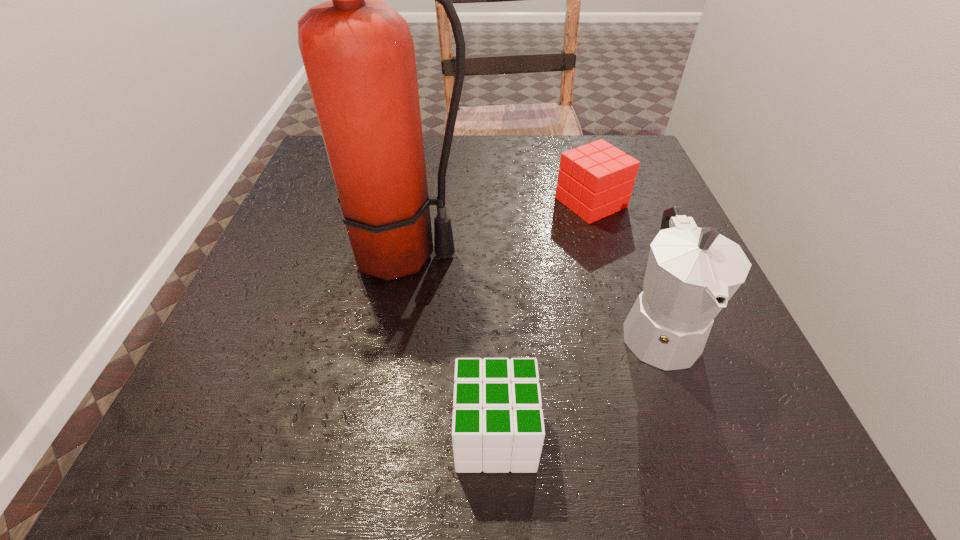
Where is `vacant space located 0.370m on the red face of the nearest object`? vacant space located 0.370m on the red face of the nearest object is located at coordinates (178, 434).

Locate an element on the screen. Image resolution: width=960 pixels, height=540 pixels. vacant area situated on the red face of the nearest object is located at coordinates (170, 434).

Identify the location of object that is at the far edge. The image size is (960, 540). (595, 180).

What are the coordinates of `object at the near edge` in the screenshot? It's located at (504, 409).

This screenshot has height=540, width=960. Identify the location of object that is at the left edge. pyautogui.click(x=358, y=53).

You are a GUI agent. You are given a task and a screenshot of the screen. Output one action in this format:
    pyautogui.click(x=<x>, y=<y>)
    Task: Click on the coffeepot positioned at the right edge
    
    Given the screenshot: What is the action you would take?
    pyautogui.click(x=691, y=274)

The image size is (960, 540). Find the location of `cube at the right edge`. cube at the right edge is located at coordinates (595, 180).

Image resolution: width=960 pixels, height=540 pixels. I want to click on object positioned at the far right corner, so click(x=595, y=180).

In the image, there is a desktop. Where is `vacant space at the far edge`? This screenshot has width=960, height=540. vacant space at the far edge is located at coordinates (487, 141).

Find the location of a particular element. vacant area at the near edge of the desktop is located at coordinates (365, 455).